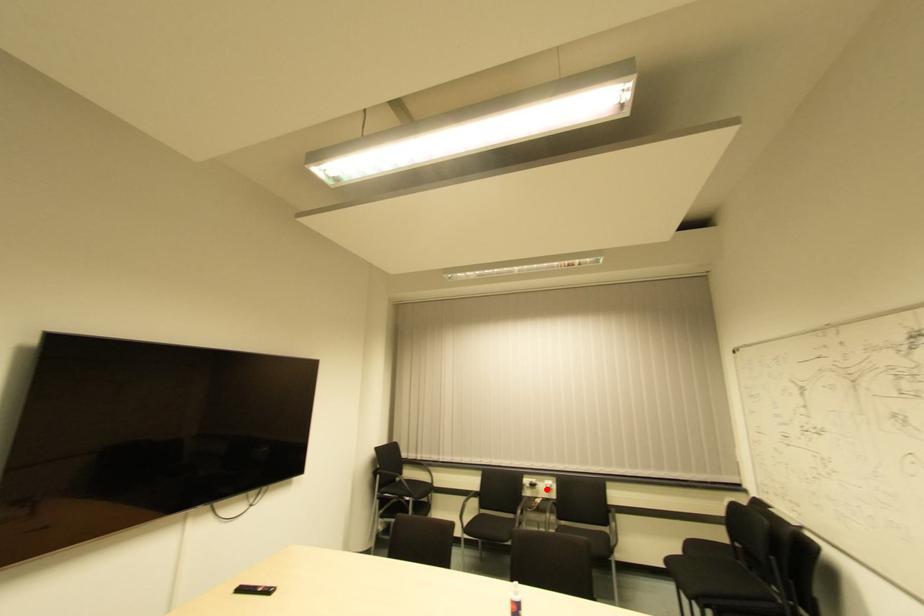
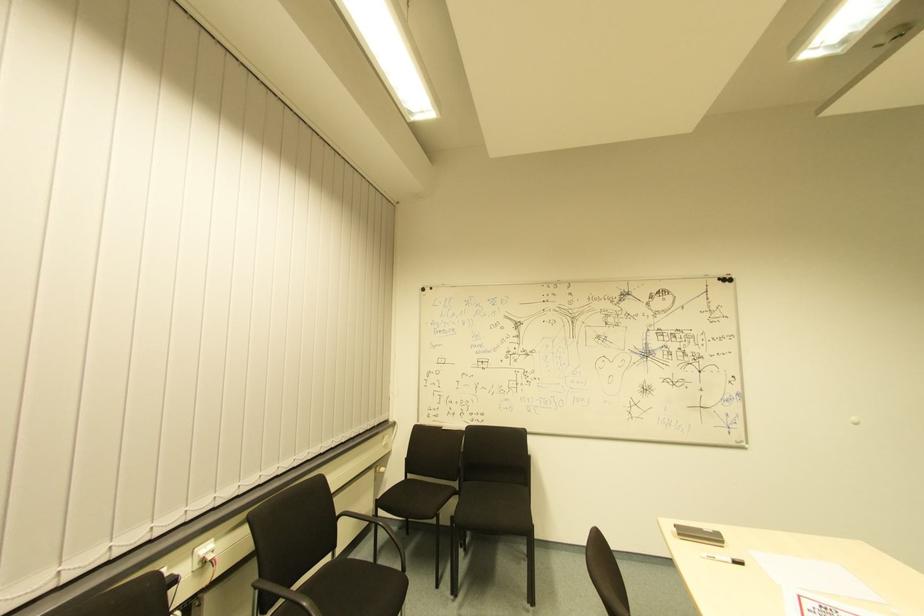
Locate, in the second image, the point that corresponds to the highlighted location in the first image.

(208, 561)